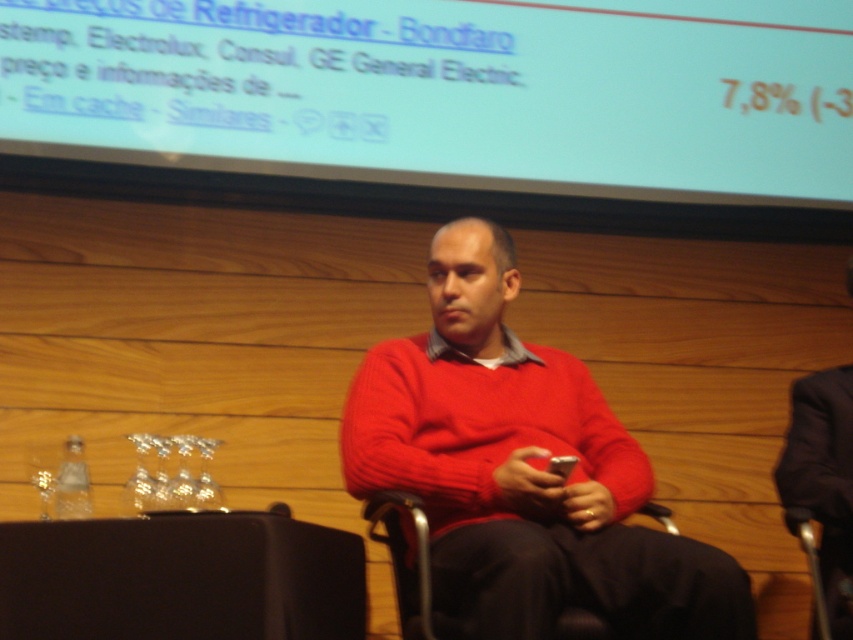
You are an interior designer assessing the seating arrangement in the conference room. The knitted red sweater at center and the metallic silver chair at center are both in the foreground. Which object is wider?

The knitted red sweater at center is wider than the metallic silver chair at center according to the description.

You are a photographer trying to capture a closeup of the knitted red sweater at center. The camera you are using has a focus point at coordinate point (521,470). Will the knitted red sweater at center be in focus?

The knitted red sweater at center is located at point (521,470), so yes, the sweater will be in focus because the focus point is exactly where the sweater is located.

You are an event organizer who needs to adjust the seating arrangement for a presentation. The metallic silver chair at center is where the presenter will sit. To ensure the presenter can easily view the white matte projection screen at upper center, should you move the chair to the left or right?

The white matte projection screen at upper center is to the right of the metallic silver chair at center. To ensure the presenter can easily view the screen, the chair should be moved to the left so that the screen is centered in their view.